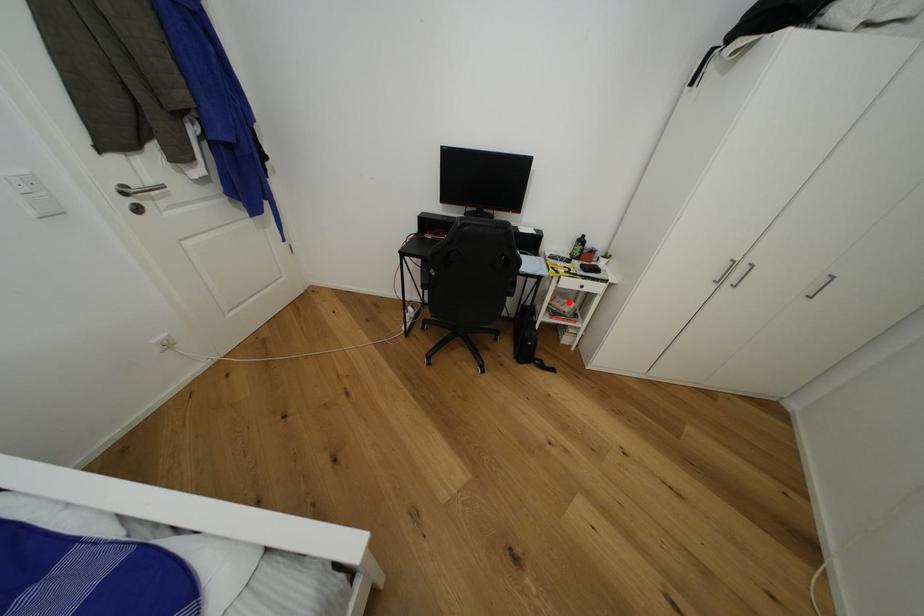
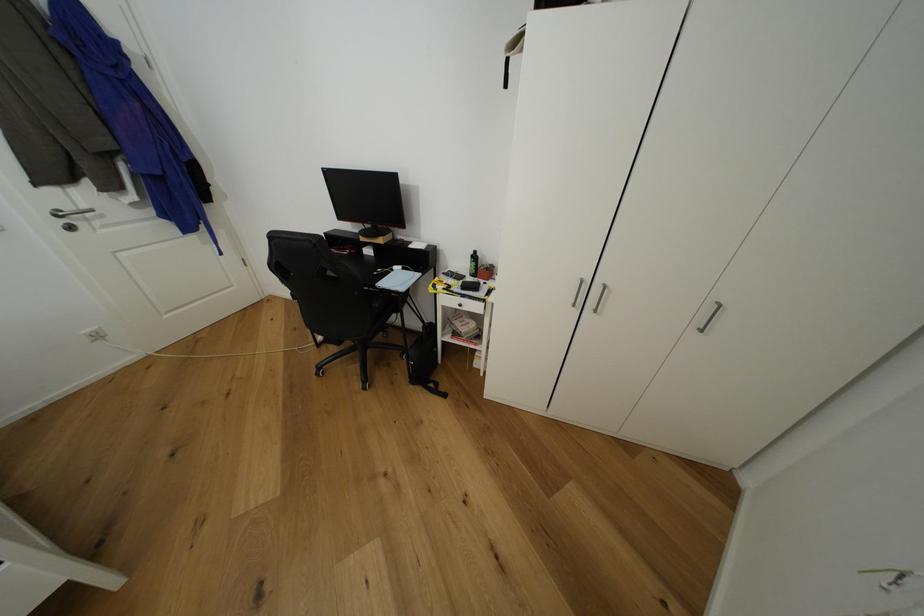
In the second image, find the point that corresponds to the highlighted location in the first image.

(472, 322)